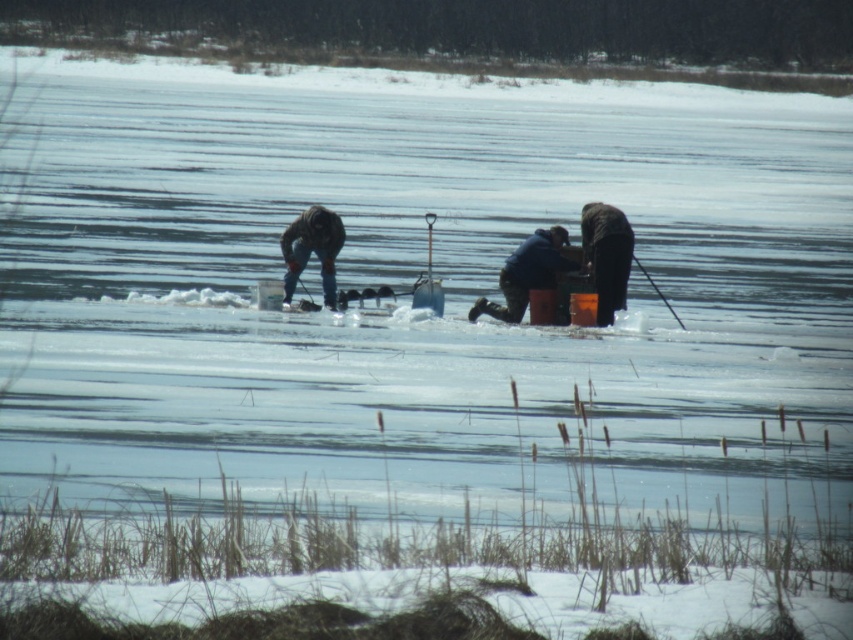
Who is taller, black matte jacket at center or dark gray jacket at center?

Standing taller between the two is black matte jacket at center.

From the picture: Can you confirm if black matte jacket at center is shorter than dark gray jacket at center?

No, black matte jacket at center is not shorter than dark gray jacket at center.

Describe the element at coordinates (606, 256) in the screenshot. The height and width of the screenshot is (640, 853). I see `black matte jacket at center` at that location.

You are a GUI agent. You are given a task and a screenshot of the screen. Output one action in this format:
    pyautogui.click(x=<x>, y=<y>)
    Task: Click on the black matte jacket at center
    
    Given the screenshot: What is the action you would take?
    pyautogui.click(x=606, y=256)

Is blue fabric jacket at center bigger than black matte jacket at center?

Indeed, blue fabric jacket at center has a larger size compared to black matte jacket at center.

Between point (548, 237) and point (611, 216), which one is positioned behind?

Positioned behind is point (548, 237).

Is point (515, 280) positioned before point (590, 225)?

That is True.

This screenshot has width=853, height=640. Identify the location of blue fabric jacket at center. (527, 273).

Does blue fabric jacket at center have a lesser height compared to dark gray jacket at center?

Yes, blue fabric jacket at center is shorter than dark gray jacket at center.

Does blue fabric jacket at center have a lesser width compared to dark gray jacket at center?

Incorrect, blue fabric jacket at center's width is not less than dark gray jacket at center's.

Which is behind, point (512, 300) or point (318, 246)?

The point (512, 300) is behind.

Image resolution: width=853 pixels, height=640 pixels. Identify the location of blue fabric jacket at center. (527, 273).